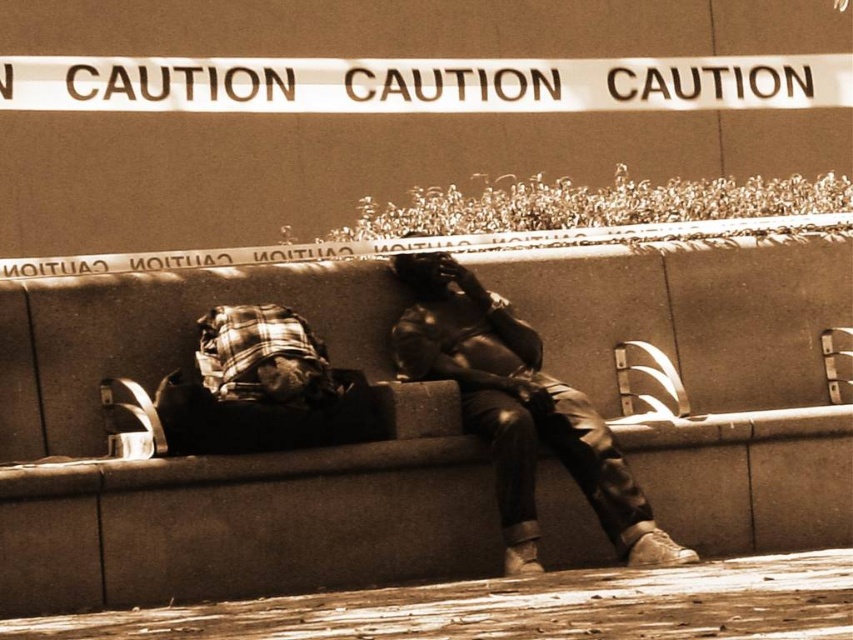
Does smooth concrete bench at center have a greater height compared to plaid fabric bag at lower left?

Incorrect, smooth concrete bench at center's height is not larger of plaid fabric bag at lower left's.

Image resolution: width=853 pixels, height=640 pixels. In order to click on smooth concrete bench at center in this screenshot , I will do tap(221, 456).

Does matte black jacket at center appear on the right side of plaid fabric bag at lower left?

Yes, matte black jacket at center is to the right of plaid fabric bag at lower left.

How distant is matte black jacket at center from plaid fabric bag at lower left?

A distance of 1.34 meters exists between matte black jacket at center and plaid fabric bag at lower left.

Is point (563, 394) more distant than point (373, 426)?

Yes, it is behind point (373, 426).

Where is `matte black jacket at center`? The height and width of the screenshot is (640, 853). matte black jacket at center is located at coordinates (518, 410).

Is smooth concrete bench at center thinner than matte black jacket at center?

Correct, smooth concrete bench at center's width is less than matte black jacket at center's.

Between smooth concrete bench at center and matte black jacket at center, which one appears on the left side from the viewer's perspective?

Positioned to the left is smooth concrete bench at center.

Between point (450, 420) and point (490, 317), which one is positioned behind?

The point (490, 317) is more distant.

The width and height of the screenshot is (853, 640). In order to click on smooth concrete bench at center in this screenshot , I will do `click(221, 456)`.